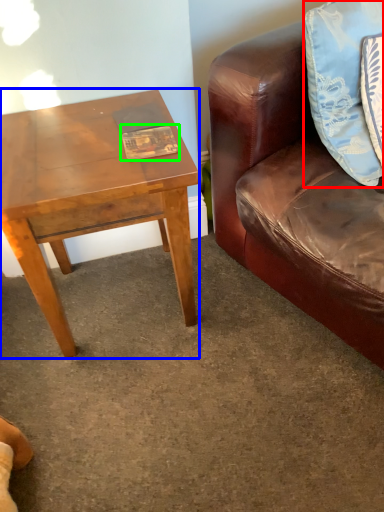
Question: Estimate the real-world distances between objects in this image. Which object is farther from pillow (highlighted by a red box), coffee table (highlighted by a blue box) or book (highlighted by a green box)?

Choices:
 (A) coffee table
 (B) book

Answer: (A)